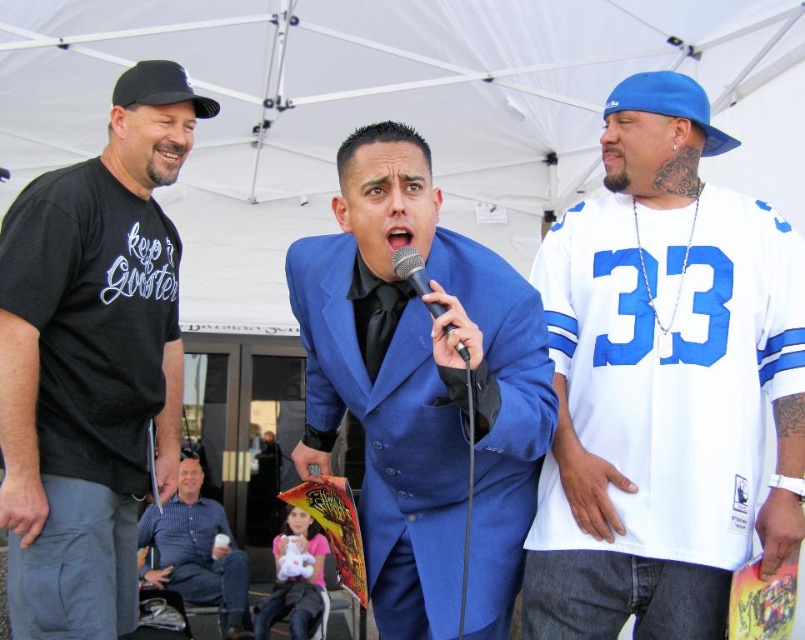
Question: In this image, where is blue striped shirt at lower left located relative to blue fabric baseball cap at upper right?

Choices:
 (A) left
 (B) right

Answer: (A)

Question: Can you confirm if blue striped shirt at lower left is thinner than black fabric baseball cap at upper left?

Choices:
 (A) yes
 (B) no

Answer: (B)

Question: Does blue fabric baseball cap at upper right come behind black metallic microphone at center?

Choices:
 (A) yes
 (B) no

Answer: (A)

Question: Among these points, which one is farthest from the camera?

Choices:
 (A) (647, 84)
 (B) (106, 172)

Answer: (B)

Question: Which object is positioned farthest from the blue fabric baseball cap at upper right?

Choices:
 (A) shiny blue suit at center
 (B) black metallic microphone at center
 (C) white jersey at right

Answer: (B)

Question: Among these objects, which one is nearest to the camera?

Choices:
 (A) black t-shirt at left
 (B) shiny blue suit at center
 (C) blue striped shirt at lower left
 (D) black fabric baseball cap at upper left

Answer: (B)